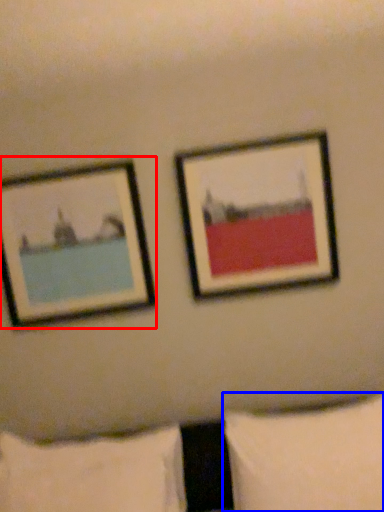
Question: Which of the following is the farthest to the observer, picture frame (highlighted by a red box) or pillow (highlighted by a blue box)?

Choices:
 (A) picture frame
 (B) pillow

Answer: (A)